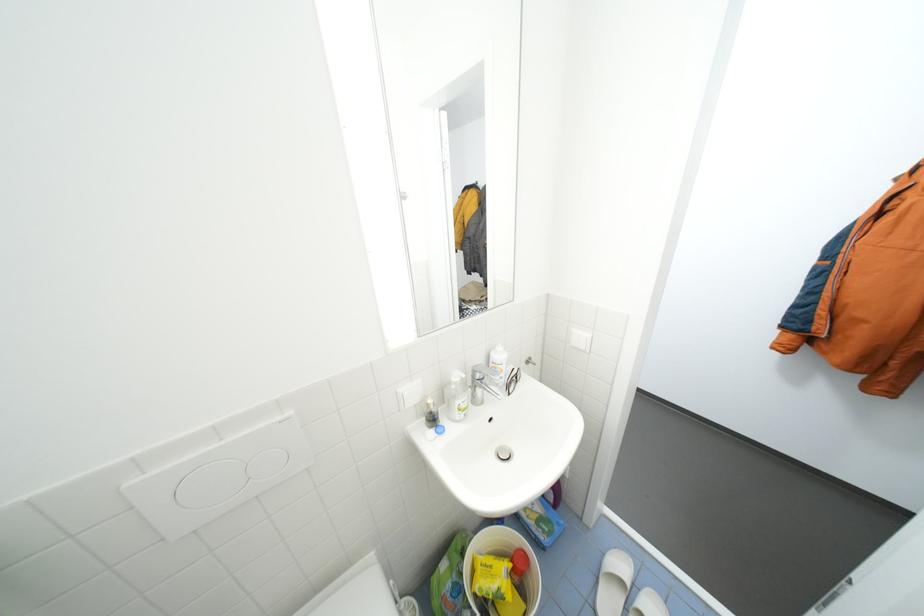
The image size is (924, 616). Describe the element at coordinates (187, 493) in the screenshot. I see `the large flush button` at that location.